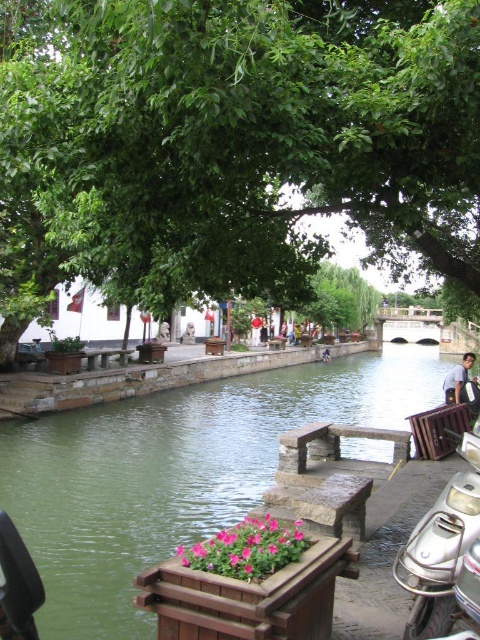
You are a tourist standing at the canal and see the green leafy tree at upper center and the silver metallic motorcycle at lower right. Which object is closer to the left side of the canal?

The green leafy tree at upper center is closer to the left side of the canal because it is positioned to the left of the silver metallic motorcycle at lower right.

You are standing at the point labeled point (231, 147) in the scene. What do you see directly in front of you?

You see a green leafy tree at upper center directly in front of you at the point labeled point (231, 147).